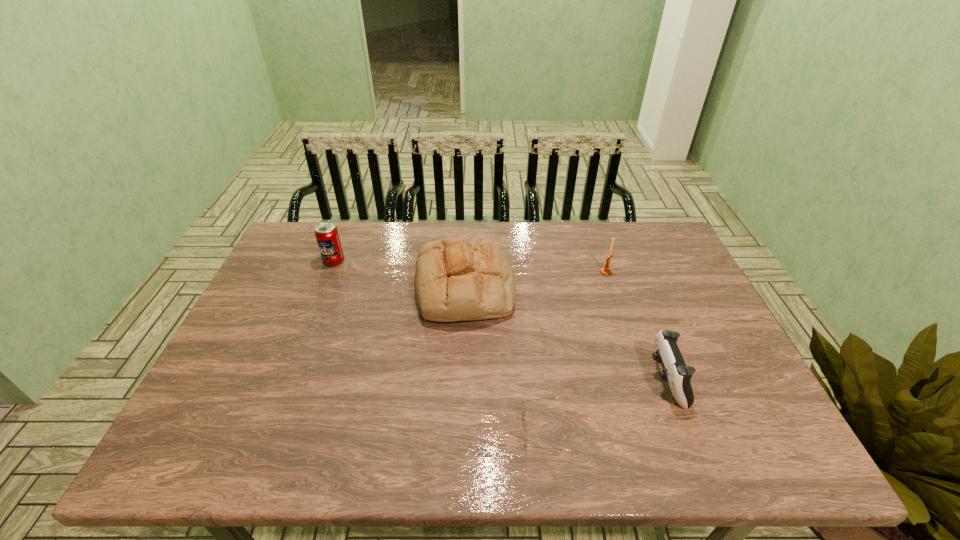
Locate an element on the screen. The height and width of the screenshot is (540, 960). bread is located at coordinates (456, 279).

The width and height of the screenshot is (960, 540). I want to click on the fourth object from left to right, so click(x=606, y=271).

Locate an element on the screen. This screenshot has width=960, height=540. the leftmost object is located at coordinates (327, 236).

You are a GUI agent. You are given a task and a screenshot of the screen. Output one action in this format:
    pyautogui.click(x=<x>, y=<y>)
    Task: Click on the rightmost object
    The width and height of the screenshot is (960, 540).
    Given the screenshot: What is the action you would take?
    pyautogui.click(x=675, y=372)

The width and height of the screenshot is (960, 540). What are the coordinates of `the second shortest object` in the screenshot? It's located at (675, 372).

Identify the location of the shortest object. Image resolution: width=960 pixels, height=540 pixels. (523, 407).

Identify the location of vacant space positioned 0.350m on the front of the bread. This screenshot has width=960, height=540. (458, 453).

The height and width of the screenshot is (540, 960). I want to click on vacant space located 0.140m on the right of the fourth object from left to right, so click(657, 272).

This screenshot has width=960, height=540. I want to click on vacant space located 0.080m on the back of the soda can, so click(343, 239).

The image size is (960, 540). Identify the location of vacant space positioned on the front-facing side of the second shortest object. (514, 380).